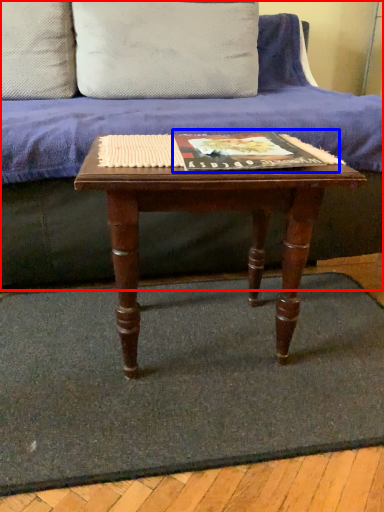
Question: Which object appears farthest to the camera in this image, studio couch (highlighted by a red box) or paperback book (highlighted by a blue box)?

Choices:
 (A) studio couch
 (B) paperback book

Answer: (A)